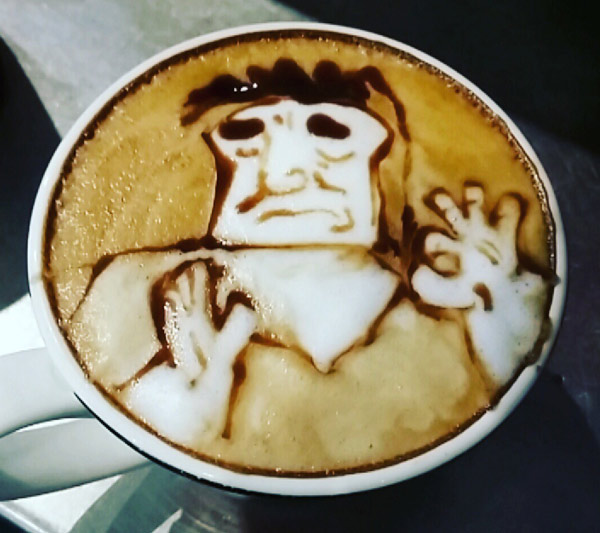
This screenshot has height=533, width=600. What are the coordinates of `chest` in the screenshot? It's located at (333, 303).